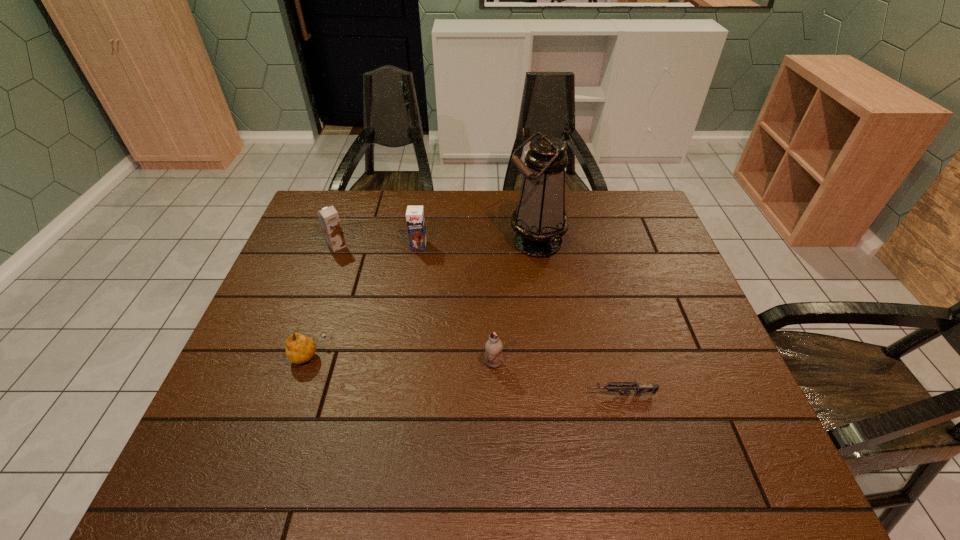
In order to click on unoccupied position between the second shortest object and the third object from left to right in this screenshot , I will do `click(364, 300)`.

Find the location of `vacant space that is in between the leftmost chocolate milk and the shortest chocolate milk`. vacant space that is in between the leftmost chocolate milk and the shortest chocolate milk is located at coordinates (415, 305).

The height and width of the screenshot is (540, 960). Find the location of `free space between the shortest chocolate milk and the leftmost chocolate milk`. free space between the shortest chocolate milk and the leftmost chocolate milk is located at coordinates click(x=415, y=305).

The width and height of the screenshot is (960, 540). What are the coordinates of `free space between the leftmost chocolate milk and the fifth tallest object` in the screenshot? It's located at (323, 301).

The height and width of the screenshot is (540, 960). In order to click on empty space that is in between the leftmost chocolate milk and the second chocolate milk from left to right in this screenshot , I will do `click(378, 246)`.

Locate an element on the screen. This screenshot has width=960, height=540. object that is the fourth closest to the nearest chocolate milk is located at coordinates (415, 219).

Find the location of a particular element. This screenshot has width=960, height=540. object that is the fourth closest one to the second chocolate milk from right to left is located at coordinates (494, 346).

Identify the location of chocolate milk that can be found as the closest to the fifth tallest object. The image size is (960, 540). (328, 216).

Where is `chocolate milk object that ranks as the closest to the nearest object`? Image resolution: width=960 pixels, height=540 pixels. chocolate milk object that ranks as the closest to the nearest object is located at coordinates (494, 346).

Identify the location of vacant space that satisfies the following two spatial constraints: 1. on the front label of the shortest chocolate milk; 2. on the right side of the third object from left to right. 400,363.